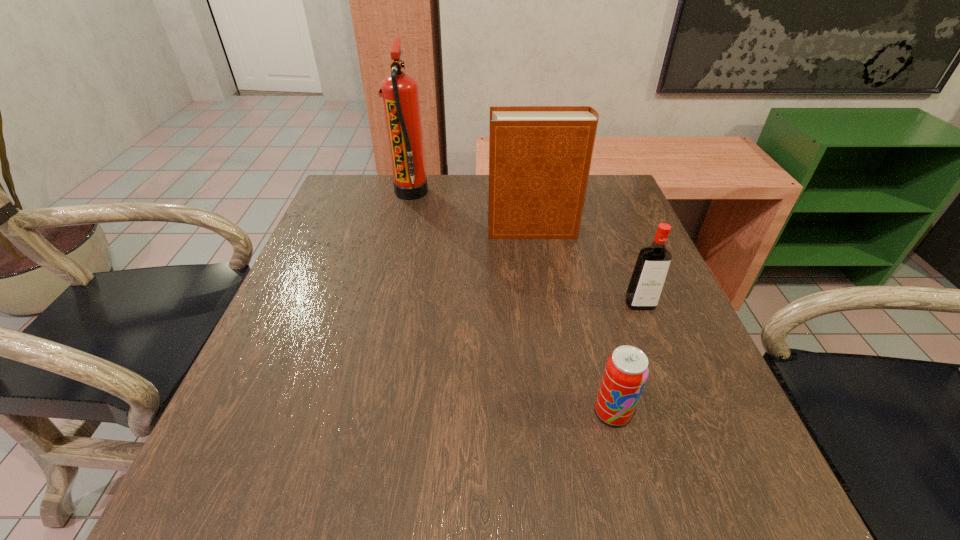
What are the coordinates of `vacant point located between the hardback book and the second nearest object` in the screenshot? It's located at (587, 267).

In order to click on free area in between the second farthest object and the tallest object in this screenshot , I will do `click(472, 211)`.

Where is `vacant area between the second tallest object and the leftmost object`? The width and height of the screenshot is (960, 540). vacant area between the second tallest object and the leftmost object is located at coordinates (472, 211).

The width and height of the screenshot is (960, 540). I want to click on free space between the third farthest object and the second tallest object, so click(587, 267).

Identify the location of vacant area that lies between the fire extinguisher and the soda can. (512, 302).

I want to click on unoccupied position between the leftmost object and the shortest object, so pos(512,302).

Where is `unoccupied position between the shortest object and the fire extinguisher`? This screenshot has width=960, height=540. unoccupied position between the shortest object and the fire extinguisher is located at coordinates (512, 302).

This screenshot has height=540, width=960. Identify the location of object that is the third closest one to the farthest object. (626, 371).

Select which object is the closest to the nearest object. Please provide its 2D coordinates. Your answer should be formatted as a tuple, i.e. [(x, y)], where the tuple contains the x and y coordinates of a point satisfying the conditions above.

[(648, 278)]

Where is `vacant space that satisfies the following two spatial constraints: 1. on the open cover of the soda can; 2. on the left side of the third shortest object`? Image resolution: width=960 pixels, height=540 pixels. vacant space that satisfies the following two spatial constraints: 1. on the open cover of the soda can; 2. on the left side of the third shortest object is located at coordinates point(563,412).